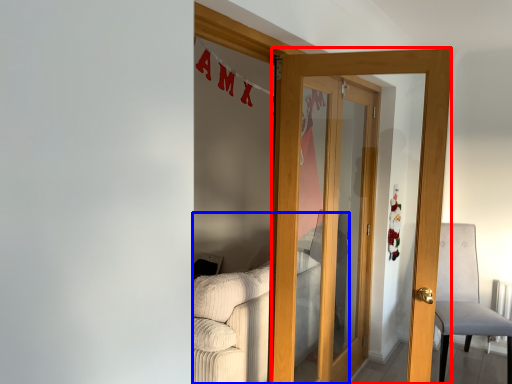
Question: Which of the following is the closest to the observer, door (highlighted by a red box) or couch (highlighted by a blue box)?

Choices:
 (A) door
 (B) couch

Answer: (A)